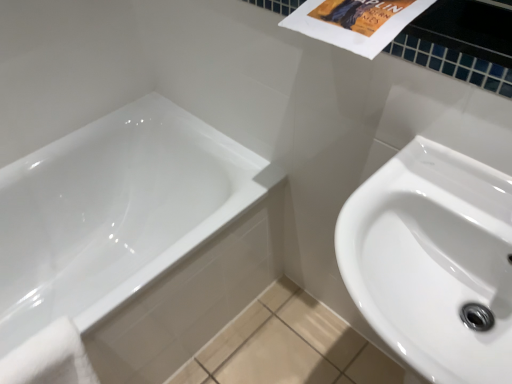
Locate an element on the screen. white glossy bathtub at lower left is located at coordinates (137, 238).

In order to face white glossy bathtub at lower left, should I rotate leftwards or rightwards?

Turn left by 18.286 degrees to look at white glossy bathtub at lower left.

I want to click on white glossy bathtub at lower left, so click(x=137, y=238).

Find the location of `bathtub below the white soft towel at lower left (from a real-world perspective)`. bathtub below the white soft towel at lower left (from a real-world perspective) is located at coordinates coord(137,238).

Looking at this image, how much distance is there between white soft towel at lower left and white glossy bathtub at lower left?

The distance of white soft towel at lower left from white glossy bathtub at lower left is 17.35 inches.

Does white soft towel at lower left turn towards white glossy bathtub at lower left?

Yes, white soft towel at lower left faces towards white glossy bathtub at lower left.

Which is behind, point (23, 379) or point (187, 237)?

The point (187, 237) is behind.

Does white glossy sink at right touch white glossy bathtub at lower left?

No, white glossy sink at right is not with white glossy bathtub at lower left.

Identify the location of sink that is in front of the white glossy bathtub at lower left. The image size is (512, 384). (433, 260).

Based on the photo, considering the sizes of objects white glossy sink at right and white glossy bathtub at lower left in the image provided, who is bigger, white glossy sink at right or white glossy bathtub at lower left?

With larger size is white glossy bathtub at lower left.

Based on the photo, which is closer, (492, 254) or (131, 315)?

Positioned in front is point (492, 254).

Does white glossy bathtub at lower left lie in front of white glossy sink at right?

No, white glossy bathtub at lower left is further to the viewer.

From the image's perspective, which one is positioned higher, white glossy bathtub at lower left or white glossy sink at right?

white glossy bathtub at lower left is shown above in the image.

Considering the relative sizes of white glossy bathtub at lower left and white glossy sink at right in the image provided, is white glossy bathtub at lower left smaller than white glossy sink at right?

No, white glossy bathtub at lower left is not smaller than white glossy sink at right.

From a real-world perspective, which object stands above the other?

From a 3D spatial view, white glossy sink at right is above.

In the scene shown: Which object is wider, white glossy sink at right or white soft towel at lower left?

With larger width is white glossy sink at right.

This screenshot has height=384, width=512. I want to click on sink lying in front of the white soft towel at lower left, so click(433, 260).

From the image's perspective, is white glossy sink at right on top of white soft towel at lower left?

Yes, from the image's perspective, white glossy sink at right is over white soft towel at lower left.

Is white soft towel at lower left thinner than white glossy sink at right?

Indeed, white soft towel at lower left has a lesser width compared to white glossy sink at right.

What's the angular difference between white soft towel at lower left and white glossy sink at right's facing directions?

The facing directions of white soft towel at lower left and white glossy sink at right are 90.5 degrees apart.

In order to click on sink above the white soft towel at lower left (from the image's perspective) in this screenshot , I will do `click(433, 260)`.

Is white soft towel at lower left facing towards white glossy sink at right?

No, white soft towel at lower left is not facing towards white glossy sink at right.

Is the position of white glossy bathtub at lower left more distant than that of white soft towel at lower left?

Yes, white glossy bathtub at lower left is further from the camera.

Is white glossy bathtub at lower left spatially inside white soft towel at lower left, or outside of it?

white glossy bathtub at lower left exists outside the volume of white soft towel at lower left.

Is point (142, 284) closer or farther from the camera than point (48, 376)?

Point (142, 284) is positioned farther from the camera compared to point (48, 376).

From the image's perspective, is white glossy bathtub at lower left located above or below white soft towel at lower left?

white glossy bathtub at lower left is situated higher than white soft towel at lower left in the image.

At what (x,y) coordinates should I click in order to perform the action: click on bath towel in front of the white glossy bathtub at lower left. Please return your answer as a coordinate pair (x, y). Looking at the image, I should click on (49, 358).

I want to click on sink below the white glossy bathtub at lower left (from the image's perspective), so click(433, 260).

Looking at the image, which one is located closer to white soft towel at lower left, white glossy sink at right or white glossy bathtub at lower left?

white glossy bathtub at lower left lies closer to white soft towel at lower left than the other object.

Looking at the image, which one is located closer to white glossy sink at right, white glossy bathtub at lower left or white soft towel at lower left?

white glossy bathtub at lower left is closer to white glossy sink at right.

Based on their spatial positions, is white soft towel at lower left or white glossy sink at right closer to white glossy bathtub at lower left?

Based on the image, white soft towel at lower left appears to be nearer to white glossy bathtub at lower left.

Which object lies nearer to the anchor point white soft towel at lower left, white glossy bathtub at lower left or white glossy sink at right?

The object closer to white soft towel at lower left is white glossy bathtub at lower left.

Based on the photo, based on their spatial positions, is white glossy sink at right or white soft towel at lower left closer to white glossy bathtub at lower left?

white soft towel at lower left lies closer to white glossy bathtub at lower left than the other object.

Looking at the image, which one is located closer to white glossy sink at right, white soft towel at lower left or white glossy bathtub at lower left?

Among the two, white glossy bathtub at lower left is located nearer to white glossy sink at right.

The width and height of the screenshot is (512, 384). What are the coordinates of `bath towel between white glossy bathtub at lower left and white glossy sink at right` in the screenshot? It's located at (49, 358).